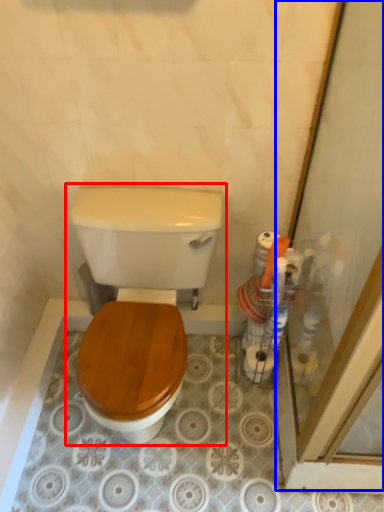
Question: Which object appears closest to the camera in this image, toilet (highlighted by a red box) or screen door (highlighted by a blue box)?

Choices:
 (A) toilet
 (B) screen door

Answer: (B)